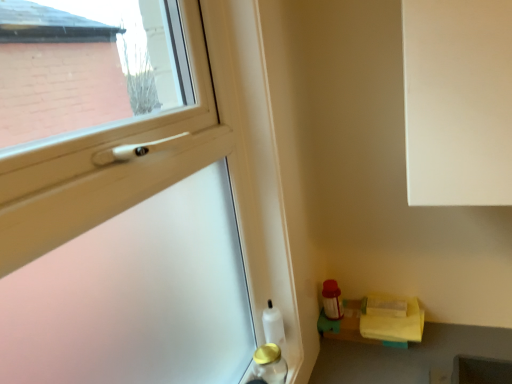
Question: Would you say yellow fabric at lower right is to the left or to the right of white glossy bottle at lower left, positioned as the second bottle in front-to-back order, in the picture?

Choices:
 (A) left
 (B) right

Answer: (B)

Question: Is yellow fabric at lower right spatially inside white glossy bottle at lower left, the 1th bottle viewed from the back, or outside of it?

Choices:
 (A) outside
 (B) inside

Answer: (A)

Question: Which object is positioned farthest from the transparent plastic screen door at lower right?

Choices:
 (A) yellow fabric at lower right
 (B) white glossy bottle at lower left, the 1th bottle viewed from the back
 (C) gold metallic bottle at lower left, which appears as the first bottle when viewed from the front

Answer: (A)

Question: Estimate the real-world distances between objects in this image. Which object is farther from the transparent plastic screen door at lower right?

Choices:
 (A) gold metallic bottle at lower left, which appears as the 2th bottle when viewed from the back
 (B) white glossy bottle at lower left, the 1th bottle viewed from the back
 (C) yellow fabric at lower right

Answer: (C)